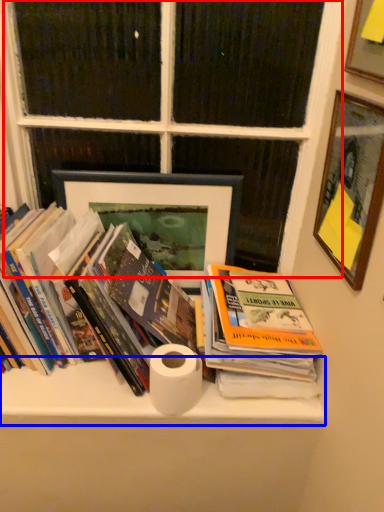
Question: Among these objects, which one is nearest to the camera, window frame (highlighted by a red box) or shelf (highlighted by a blue box)?

Choices:
 (A) window frame
 (B) shelf

Answer: (A)